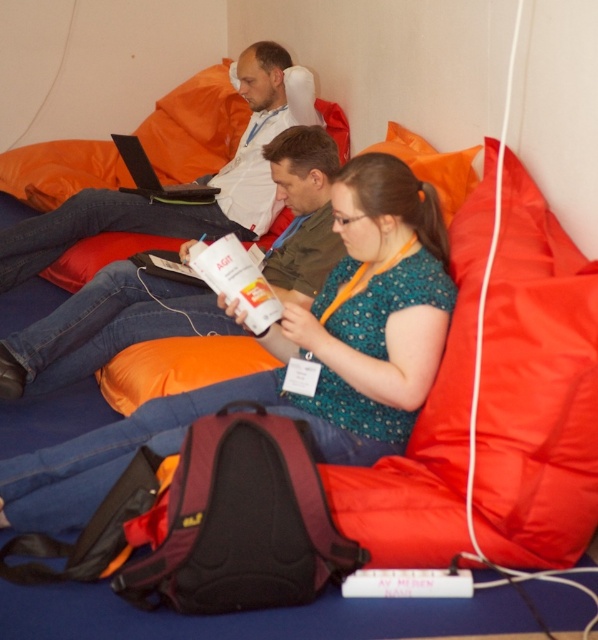
You are organizing a small event and need to place a rectangular box that is 10 cm thick between the matte green dress at center and the matte white laptop at upper center. Can the box fit between them based on their thickness?

The matte green dress at center is thinner than the matte white laptop at upper center. Since the box is 10 cm thick, and the space between them is determined by their thickness, the box can fit as long as the combined thickness of the dress and laptop allows. However, the exact dimensions aren

You are a photographer setting up for a group photo in the scene described. You need to position the matte green dress at center and the matte white laptop at upper left in your frame. Based on their positions, which object should you focus on first if you want to capture both in a single shot without moving the camera?

The matte green dress at center is below the matte white laptop at upper left. To capture both in a single shot without moving the camera, you should focus on the matte white laptop at upper left first, as it is higher in the frame, ensuring it stays within the camera view while the dress remains lower in the composition.